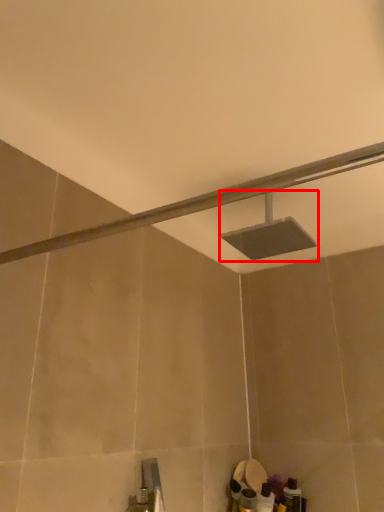
Question: From the image, what is the correct spatial relationship of shower (annotated by the red box) in relation to shower?

Choices:
 (A) right
 (B) left

Answer: (A)